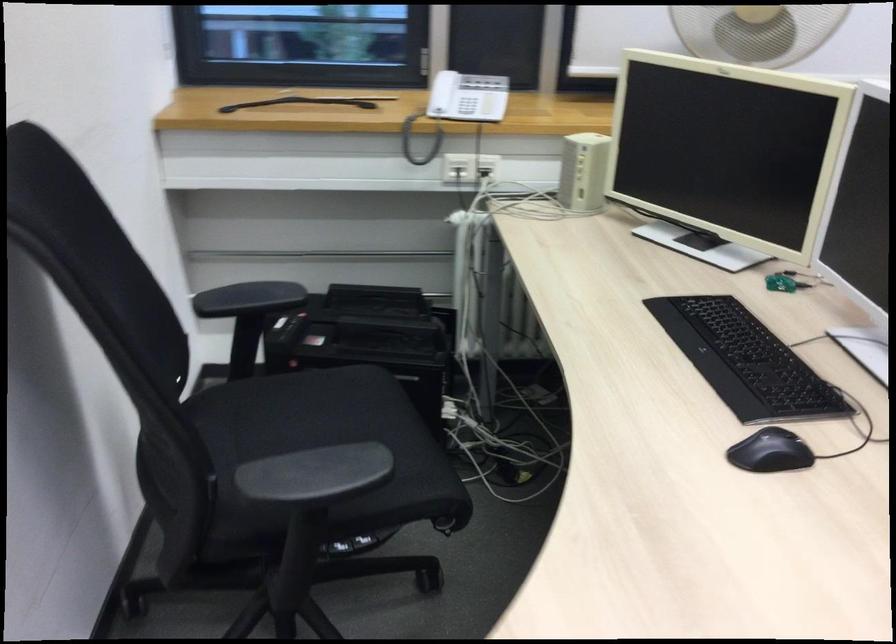
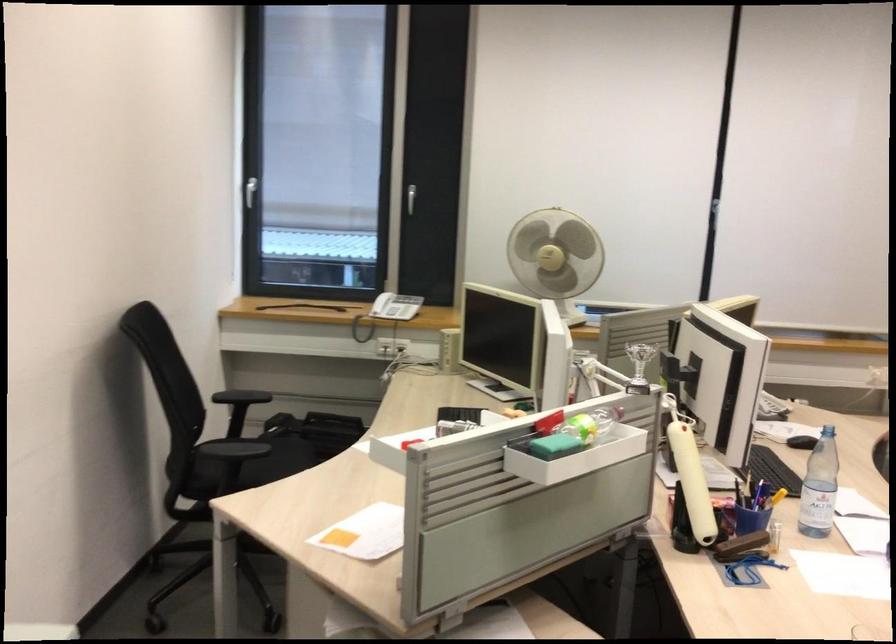
Find the pixel in the second image that matches (200,254) in the first image.

(240, 395)